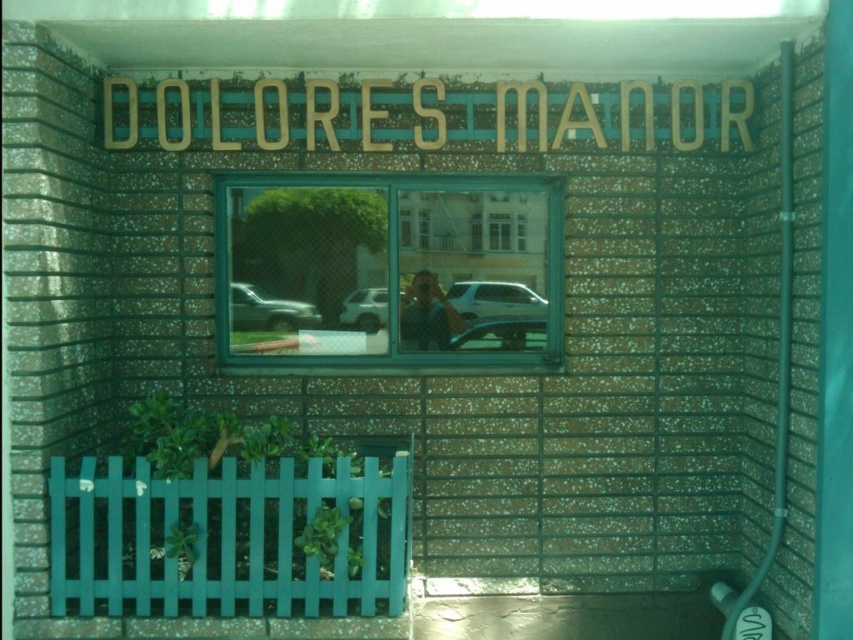
Question: Which point is farther to the camera?

Choices:
 (A) (299, 301)
 (B) (492, 294)
 (C) (503, 232)
 (D) (379, 323)

Answer: (B)

Question: Is white matte car at center smaller than clear glass window at center?

Choices:
 (A) no
 (B) yes

Answer: (A)

Question: Can you confirm if green glass window at center is wider than clear glass window at center?

Choices:
 (A) no
 (B) yes

Answer: (B)

Question: Which point appears farthest from the camera in this image?

Choices:
 (A) (233, 316)
 (B) (502, 221)
 (C) (212, 116)
 (D) (283, 253)

Answer: (B)

Question: Does green glass window at center appear under metallic silver car at center?

Choices:
 (A) yes
 (B) no

Answer: (B)

Question: Which point is closer to the camera taking this photo?

Choices:
 (A) (490, 248)
 (B) (351, 323)
 (C) (519, 109)
 (D) (309, 317)

Answer: (C)